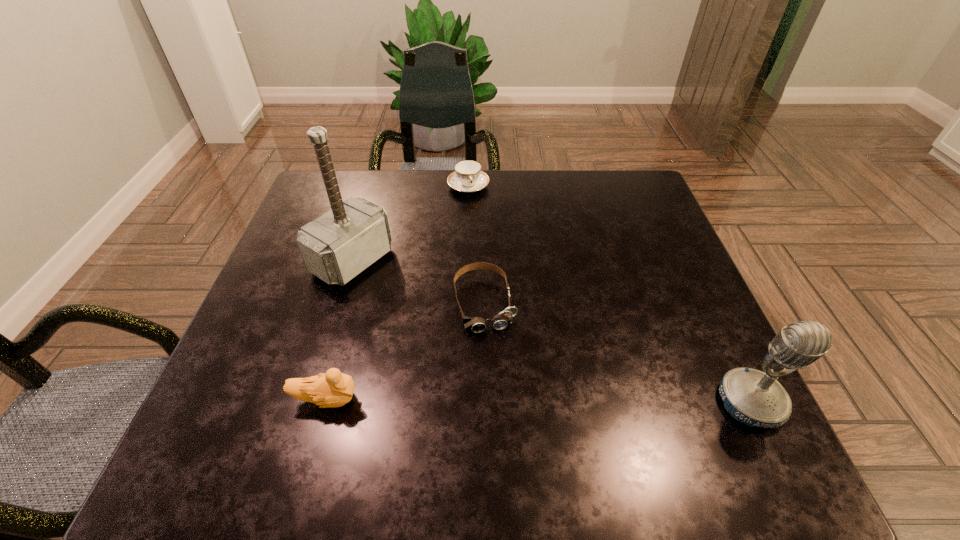
This screenshot has height=540, width=960. What are the coordinates of `vacant area between the farthest object and the second tallest object` in the screenshot? It's located at (610, 294).

This screenshot has height=540, width=960. Identify the location of vacant space that is in between the goggles and the farthest object. (476, 245).

Identify the location of free spot between the duckling and the farthest object. The image size is (960, 540). (397, 293).

Locate an element on the screen. Image resolution: width=960 pixels, height=540 pixels. free point between the goggles and the microphone is located at coordinates (617, 352).

Find the location of `free space between the duckling and the hammer`. free space between the duckling and the hammer is located at coordinates (339, 330).

You are a GUI agent. You are given a task and a screenshot of the screen. Output one action in this format:
    pyautogui.click(x=<x>, y=<y>)
    Task: Click on the free point between the fourth shortest object and the teacup
    This screenshot has width=960, height=540.
    Given the screenshot: What is the action you would take?
    pos(610,294)

Where is `vacant region between the third shortest object and the farthest object`? vacant region between the third shortest object and the farthest object is located at coordinates (397, 293).

Identify the location of vacant point located between the farthest object and the third shortest object. (397, 293).

Locate an element on the screen. The width and height of the screenshot is (960, 540). free spot between the goggles and the third shortest object is located at coordinates (405, 351).

Find the location of a particular element. The image size is (960, 540). the second closest object relative to the farthest object is located at coordinates (505, 318).